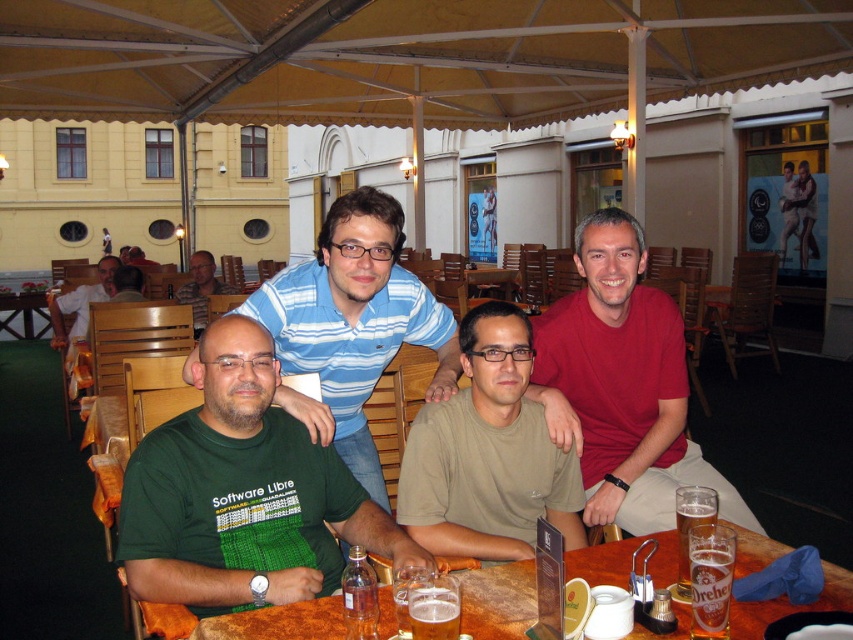
You are a photographer trying to capture a closeup of the matte red shirt at center. Based on the coordinates provided in the Objects Description, where should you position your camera relative to the shirt?

The matte red shirt at center is located at point coordinates 0.603 in the x axis and 0.730 in the y axis. Since the x and y coordinates are both between 0 and 1, the camera should be positioned directly facing the shirt to capture it in the center of the frame.

You are standing at the edge of the outdoor area and want to hand a menu to the person wearing the matte red shirt at center. If your maximum reaching distance is 7 feet, can you reach them without moving closer?

The matte red shirt at center is 7.35 feet away from the viewer, which exceeds your maximum reaching distance of 7 feet. You would need to move closer to reach them.